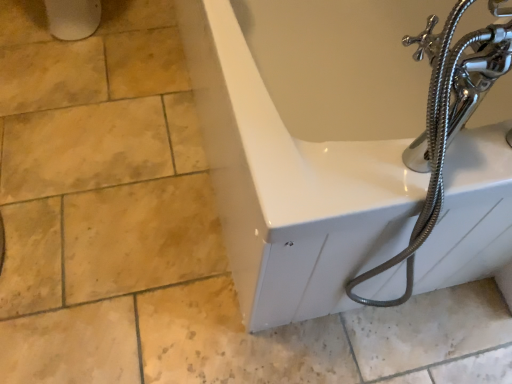
Question: Is the position of metallic silver garden hose at right less distant than that of white glossy bathtub at upper right?

Choices:
 (A) yes
 (B) no

Answer: (A)

Question: Considering the relative sizes of metallic silver garden hose at right and white glossy bathtub at upper right in the image provided, is metallic silver garden hose at right thinner than white glossy bathtub at upper right?

Choices:
 (A) yes
 (B) no

Answer: (A)

Question: Does metallic silver garden hose at right appear on the left side of white glossy bathtub at upper right?

Choices:
 (A) yes
 (B) no

Answer: (B)

Question: From the image's perspective, would you say metallic silver garden hose at right is shown under white glossy bathtub at upper right?

Choices:
 (A) no
 (B) yes

Answer: (B)

Question: Does metallic silver garden hose at right have a larger size compared to white glossy bathtub at upper right?

Choices:
 (A) no
 (B) yes

Answer: (A)

Question: From a real-world perspective, is metallic silver garden hose at right located beneath white glossy bathtub at upper right?

Choices:
 (A) no
 (B) yes

Answer: (A)

Question: Is white glossy bathtub at upper right looking in the opposite direction of metallic silver garden hose at right?

Choices:
 (A) no
 (B) yes

Answer: (A)

Question: Can you confirm if white glossy bathtub at upper right is bigger than metallic silver garden hose at right?

Choices:
 (A) yes
 (B) no

Answer: (A)

Question: Does white glossy bathtub at upper right have a lesser width compared to metallic silver garden hose at right?

Choices:
 (A) yes
 (B) no

Answer: (B)

Question: Is the position of white glossy bathtub at upper right less distant than that of metallic silver garden hose at right?

Choices:
 (A) no
 (B) yes

Answer: (A)

Question: Is white glossy bathtub at upper right wider than metallic silver garden hose at right?

Choices:
 (A) yes
 (B) no

Answer: (A)

Question: Does white glossy bathtub at upper right turn towards metallic silver garden hose at right?

Choices:
 (A) no
 (B) yes

Answer: (A)

Question: From their relative heights in the image, would you say white glossy bathtub at upper right is taller or shorter than metallic silver garden hose at right?

Choices:
 (A) short
 (B) tall

Answer: (A)